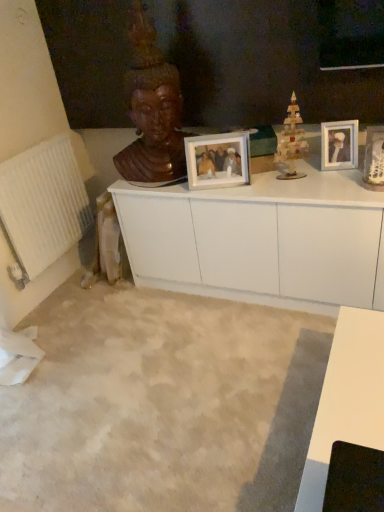
Where is `vacant area located to the right-hand side of wooden toy at center`? Image resolution: width=384 pixels, height=512 pixels. vacant area located to the right-hand side of wooden toy at center is located at coordinates (329, 173).